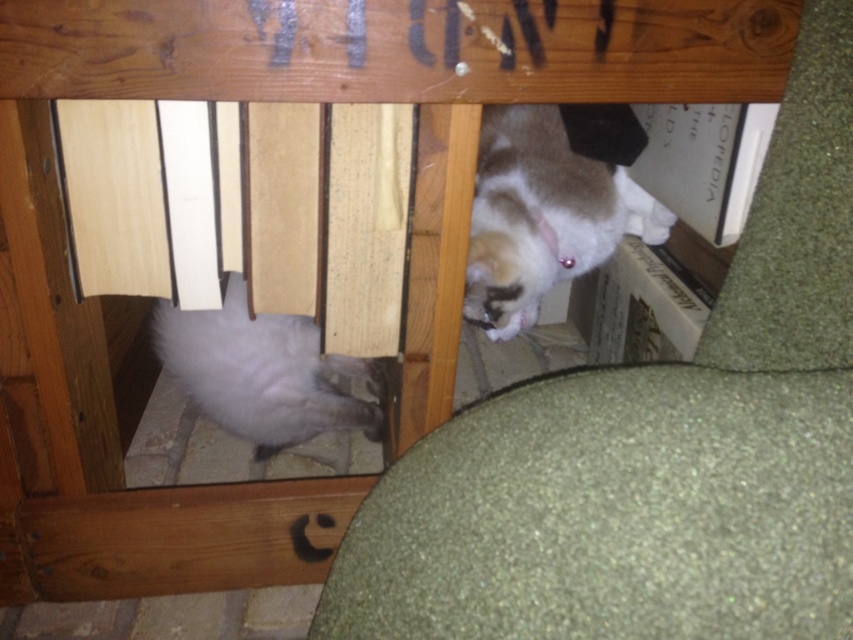
Question: Which object is positioned closest to the fuzzy fur cat at lower left?

Choices:
 (A) silvery-gray fur at lower left
 (B) fuzzy white cat at upper right

Answer: (A)

Question: Does fuzzy fur cat at lower left appear on the right side of silvery-gray fur at lower left?

Choices:
 (A) no
 (B) yes

Answer: (B)

Question: Can you confirm if fuzzy fur cat at lower left is thinner than fuzzy white cat at upper right?

Choices:
 (A) no
 (B) yes

Answer: (A)

Question: Is the position of fuzzy fur cat at lower left less distant than that of fuzzy white cat at upper right?

Choices:
 (A) no
 (B) yes

Answer: (B)

Question: Which point appears closest to the camera in this image?

Choices:
 (A) (480, 202)
 (B) (473, 452)

Answer: (B)

Question: Which object appears closest to the camera in this image?

Choices:
 (A) silvery-gray fur at lower left
 (B) fuzzy fur cat at lower left
 (C) fuzzy white cat at upper right

Answer: (B)